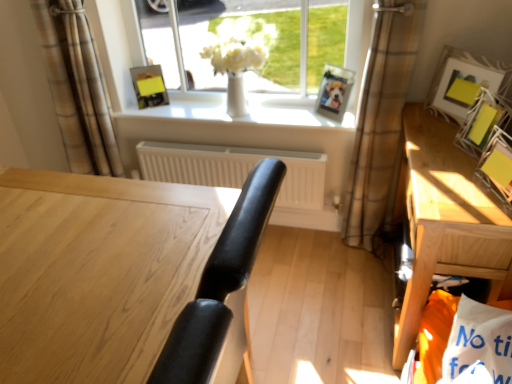
The height and width of the screenshot is (384, 512). Identify the location of vacant region above wooden table at right (from a real-world perspective). (451, 161).